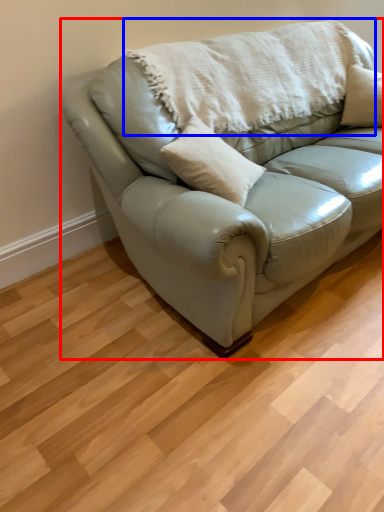
Question: Which point is closer to the camera, studio couch (highlighted by a red box) or blanket (highlighted by a blue box)?

Choices:
 (A) studio couch
 (B) blanket

Answer: (A)